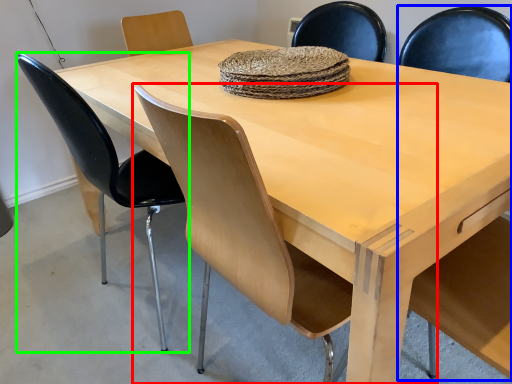
Question: Which is nearer to the chair (highlighted by a red box)? armchair (highlighted by a blue box) or chair (highlighted by a green box).

Choices:
 (A) armchair
 (B) chair

Answer: (B)